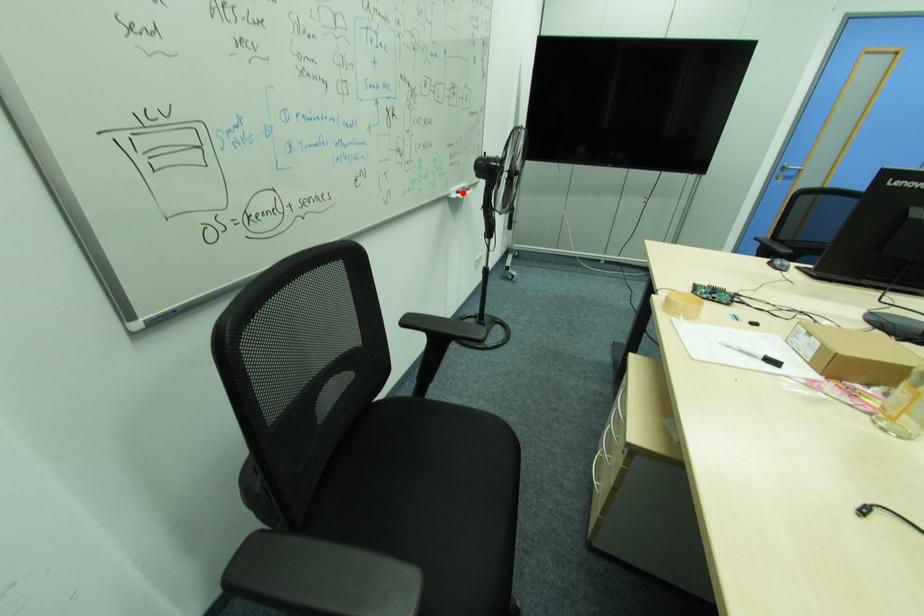
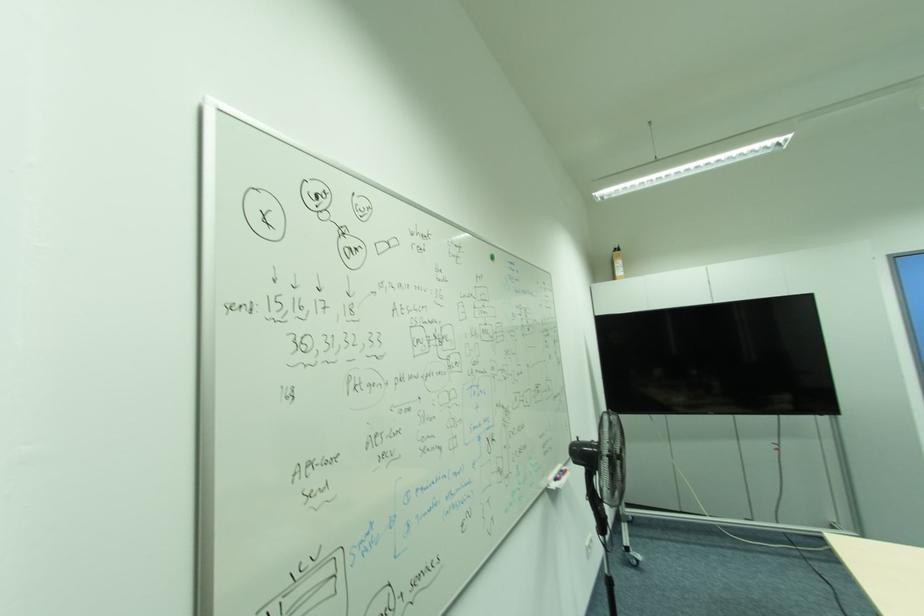
Find the pixel in the second image that matches the highlighted location in the first image.

(561, 479)